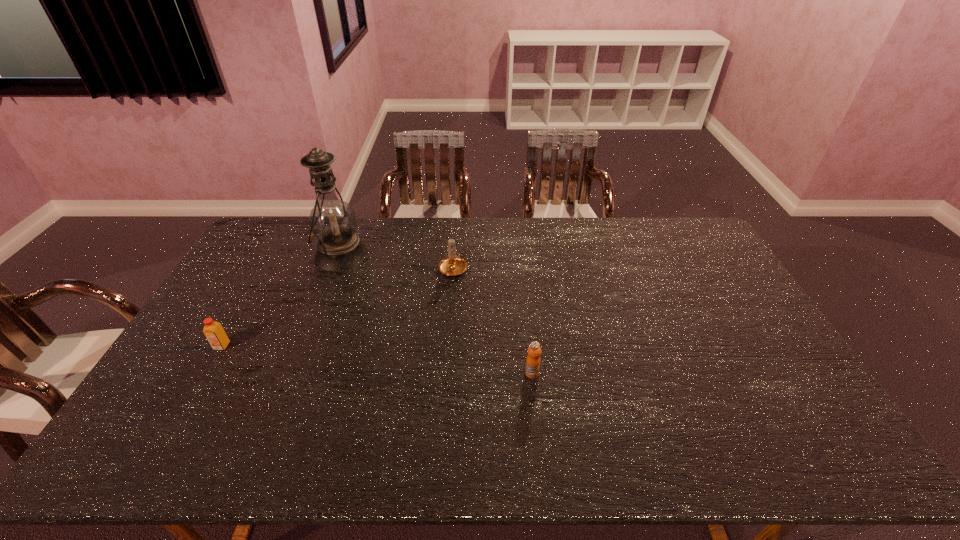
Identify the location of the second closest object relative to the third object from left to right. (533, 360).

Locate which object ranks in proximity to the second nearest object. Please provide its 2D coordinates. Your answer should be formatted as a tuple, i.e. [(x, y)], where the tuple contains the x and y coordinates of a point satisfying the conditions above.

[(332, 221)]